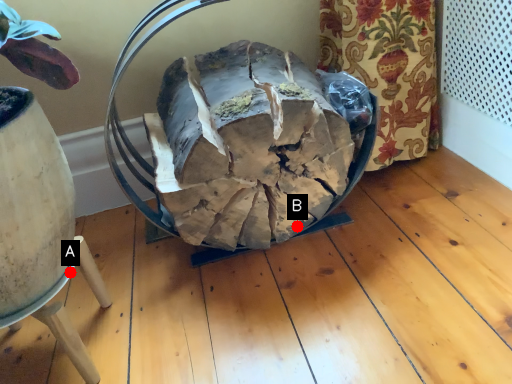
Question: Two points are circled on the image, labeled by A and B beside each circle. Among these points, which one is nearest to the camera?

Choices:
 (A) A is closer
 (B) B is closer

Answer: (A)